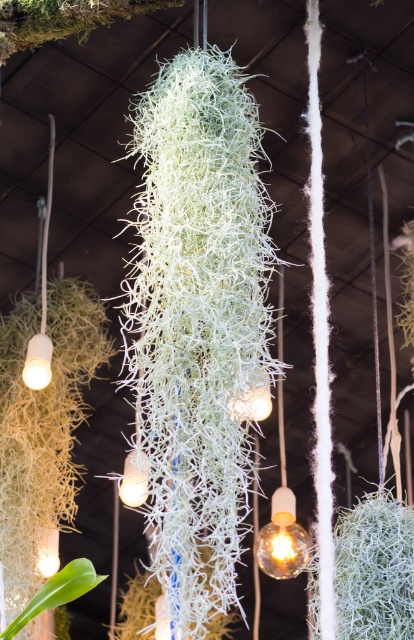
You are an interior designer planning to add a new plant to the space. You have a small fern that is 15 cm in height. Based on the sizes of the white fibrous plant at center and the green leafy plant at lower left, do you think the fern will fit well in this arrangement?

The white fibrous plant at center is bigger than the green leafy plant at lower left. Since the fern is 15 cm tall, which is likely smaller than both existing plants, it should fit well in the arrangement, possibly placed near the green leafy plant at lower left for size consistency.

You are an interior designer assessing the layout of the hanging plants and lights. Which of the two plants, the green fibrous plant at center or the green leafy plant at lower left, is closer to the observer?

The green fibrous plant at center is closer to the observer because it is further to the viewer than the green leafy plant at lower left.

You are an interior designer planning to rearrange the plants and lights in the scene. The white fibrous plant at center and the green leafy plant at lower left are too close to each other. What is the minimum distance you need to move them to ensure they are at least 16 inches apart?

The white fibrous plant at center and green leafy plant at lower left are currently 15.01 inches apart. To achieve the desired 16 inches, you need to move them a minimum of 0.99 inches apart. This can be done by moving one plant away from the other by half of the required distance, so approximately 0.495 inches each, to maintain symmetry.